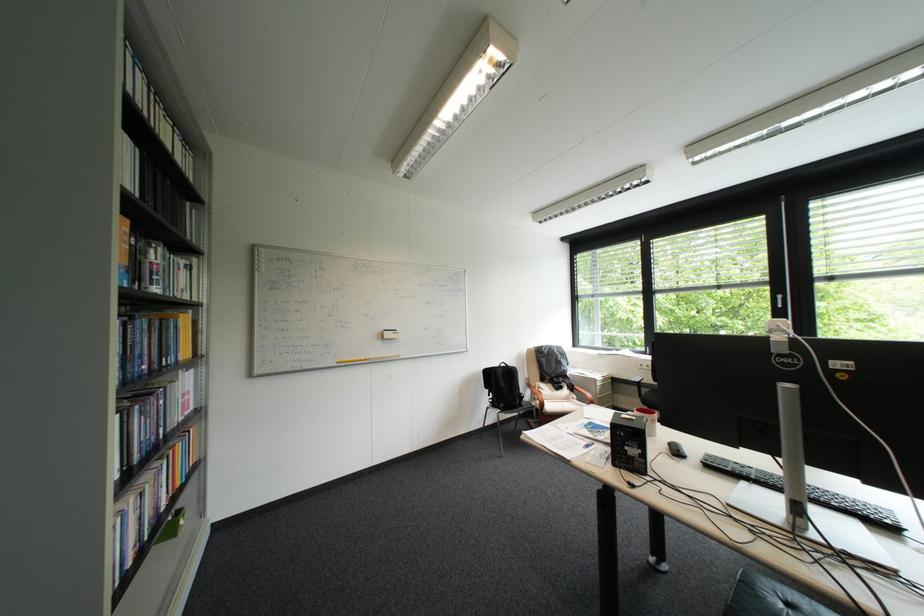
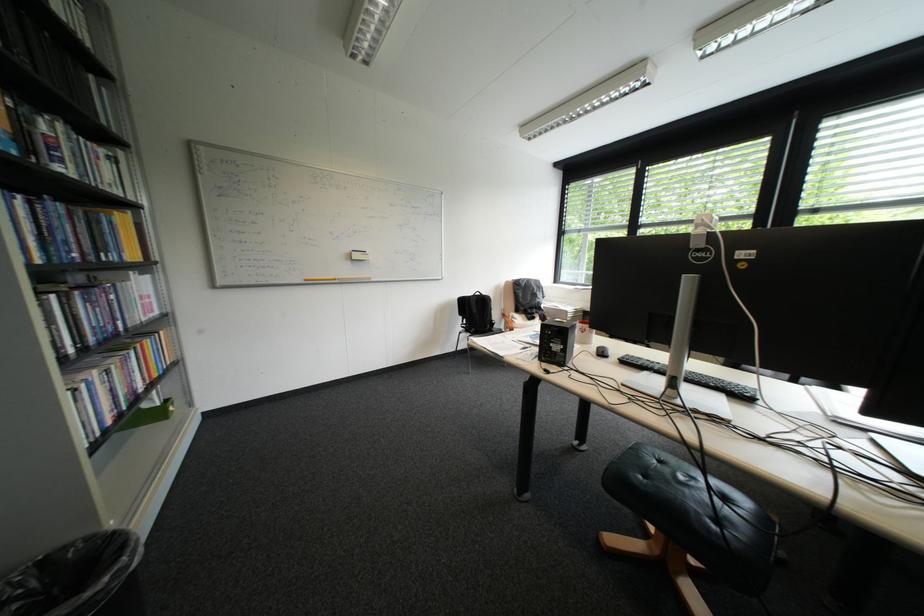
Question: What movement of the cameraman would produce the second image?

Choices:
 (A) Left
 (B) Right
 (C) Forward
 (D) Backward

Answer: (B)